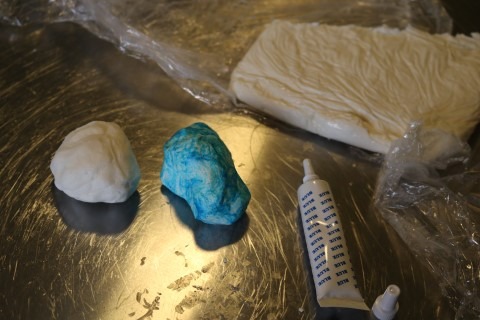
You are a GUI agent. You are given a task and a screenshot of the screen. Output one action in this format:
    pyautogui.click(x=<x>, y=<y>)
    Task: Click on the stainless steel surface
    The width and height of the screenshot is (480, 320).
    Given the screenshot: What is the action you would take?
    pyautogui.click(x=68, y=274)